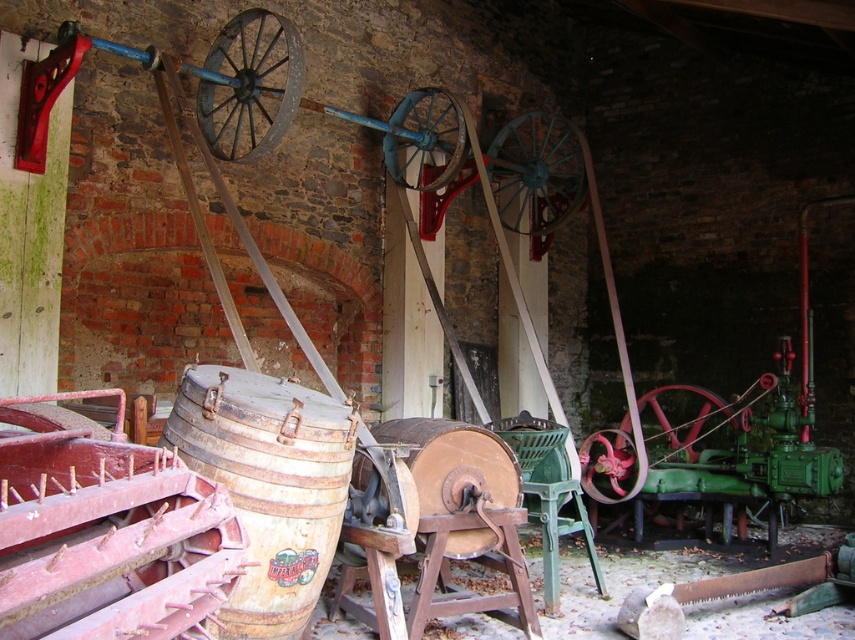
Can you confirm if rustic wooden wheel at center is shorter than rusty metal wheel at center?

Incorrect, rustic wooden wheel at center's height does not fall short of rusty metal wheel at center's.

Can you confirm if rustic wooden wheel at center is positioned below rusty metal wheel at center?

Correct, rustic wooden wheel at center is located below rusty metal wheel at center.

Is point (549, 205) positioned in front of point (385, 168)?

No, it is behind (385, 168).

The height and width of the screenshot is (640, 855). Find the location of `rustic wooden wheel at center`. rustic wooden wheel at center is located at coordinates (537, 172).

Can you confirm if wooden barrel at center is taller than rusty metal wheel at center?

No.

Between point (425, 492) and point (423, 140), which one is positioned behind?

The point (423, 140) is more distant.

Which is behind, point (405, 424) or point (428, 115)?

Point (428, 115)

This screenshot has width=855, height=640. In order to click on wooden barrel at center in this screenshot , I will do `click(457, 476)`.

Who is positioned more to the right, rusty metal wheel at center or metallic red wheel at center?

metallic red wheel at center is more to the right.

Which is above, rusty metal wheel at center or metallic red wheel at center?

rusty metal wheel at center is higher up.

Who is more distant from viewer, (423, 136) or (597, 440)?

The point (597, 440) is behind.

Locate an element on the screen. The image size is (855, 640). rusty metal wheel at center is located at coordinates (423, 140).